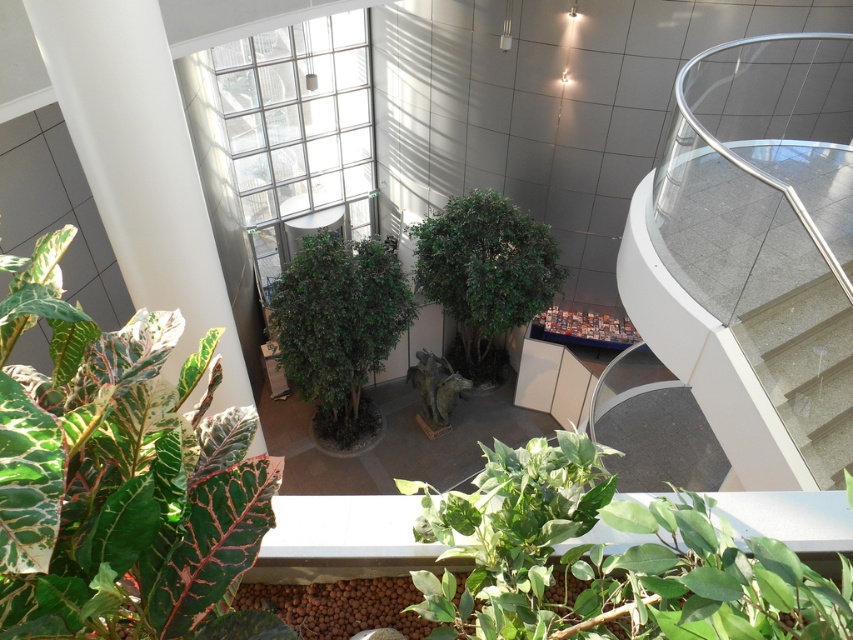
Question: Is the position of green matte plant at lower center more distant than that of green leafy plant at center?

Choices:
 (A) yes
 (B) no

Answer: (B)

Question: Considering the real-world distances, which object is farthest from the smooth concrete stairs at right?

Choices:
 (A) variegated leafy plant at lower left
 (B) green matte plant at lower center
 (C) green matte tree at center

Answer: (C)

Question: Is the position of variegated leafy plant at lower left less distant than that of smooth concrete stairs at right?

Choices:
 (A) yes
 (B) no

Answer: (A)

Question: Estimate the real-world distances between objects in this image. Which object is farther from the green matte plant at lower center?

Choices:
 (A) green matte tree at center
 (B) green leafy plant at center
 (C) smooth concrete stairs at right
 (D) variegated leafy plant at lower left

Answer: (B)

Question: Does green matte plant at lower center appear on the left side of green matte tree at center?

Choices:
 (A) yes
 (B) no

Answer: (B)

Question: Which object appears closest to the camera in this image?

Choices:
 (A) green matte tree at center
 (B) green leafy plant at center
 (C) green matte plant at lower center
 (D) smooth concrete stairs at right

Answer: (C)